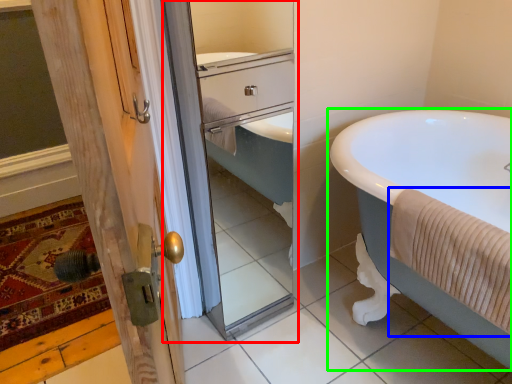
Question: Considering the real-world distances, which object is closest to screen door (highlighted by a red box)? bath towel (highlighted by a blue box) or bathtub (highlighted by a green box).

Choices:
 (A) bath towel
 (B) bathtub

Answer: (B)